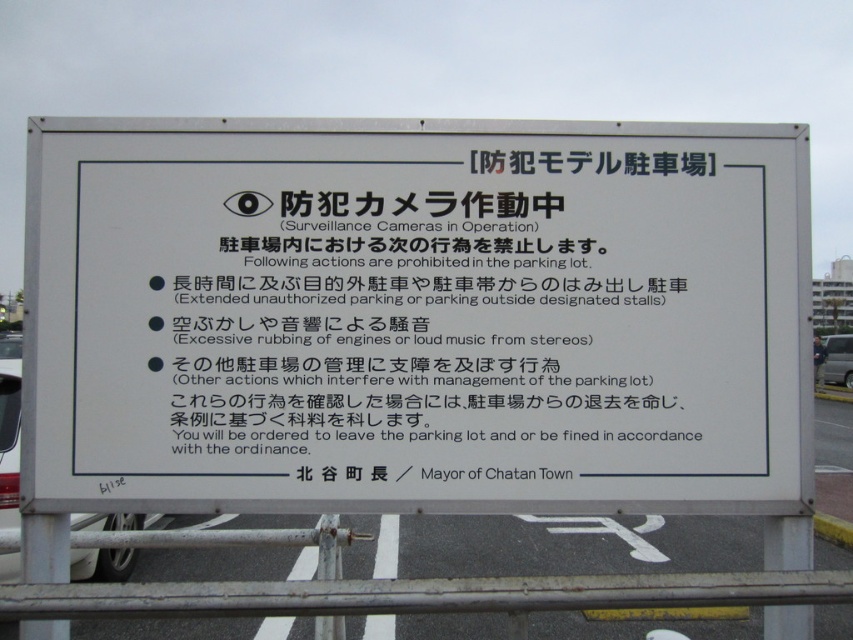
Between point (780, 234) and point (828, 376), which one is positioned in front?

Point (780, 234) is more forward.

Does point (581, 134) come in front of point (844, 362)?

Yes.

Is point (33, 189) farther from viewer compared to point (822, 369)?

No, it is in front of (822, 369).

Where is `white paper sign at center`? Image resolution: width=853 pixels, height=640 pixels. white paper sign at center is located at coordinates (416, 316).

Is red matte car at lower left to the left of matte silver van at center-right from the viewer's perspective?

Correct, you'll find red matte car at lower left to the left of matte silver van at center-right.

Is red matte car at lower left wider than matte silver van at center-right?

No.

Find the location of a particular element. red matte car at lower left is located at coordinates (9, 442).

Is white paper sign at center smaller than red matte car at lower left?

Correct, white paper sign at center occupies less space than red matte car at lower left.

Who is more forward, (x=358, y=323) or (x=4, y=528)?

Positioned in front is point (x=358, y=323).

Locate an element on the screen. white paper sign at center is located at coordinates (416, 316).

This screenshot has height=640, width=853. Identify the location of white paper sign at center. (416, 316).